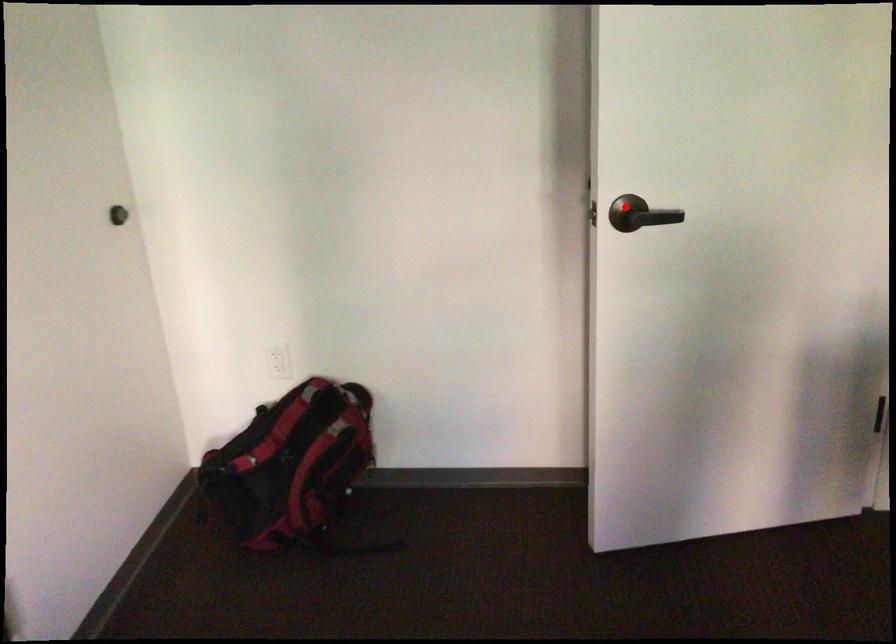
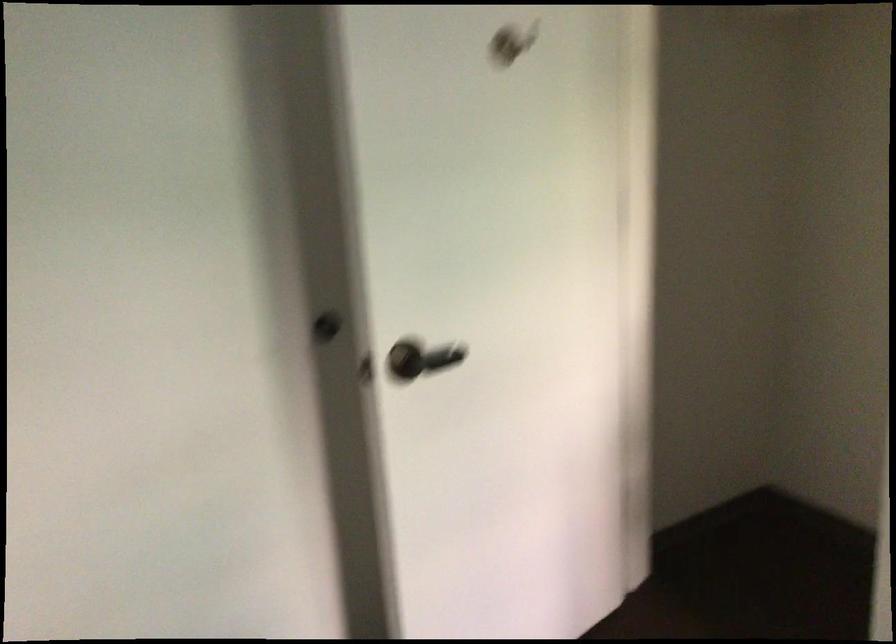
In the second image, find the point that corresponds to the highlighted location in the first image.

(407, 359)